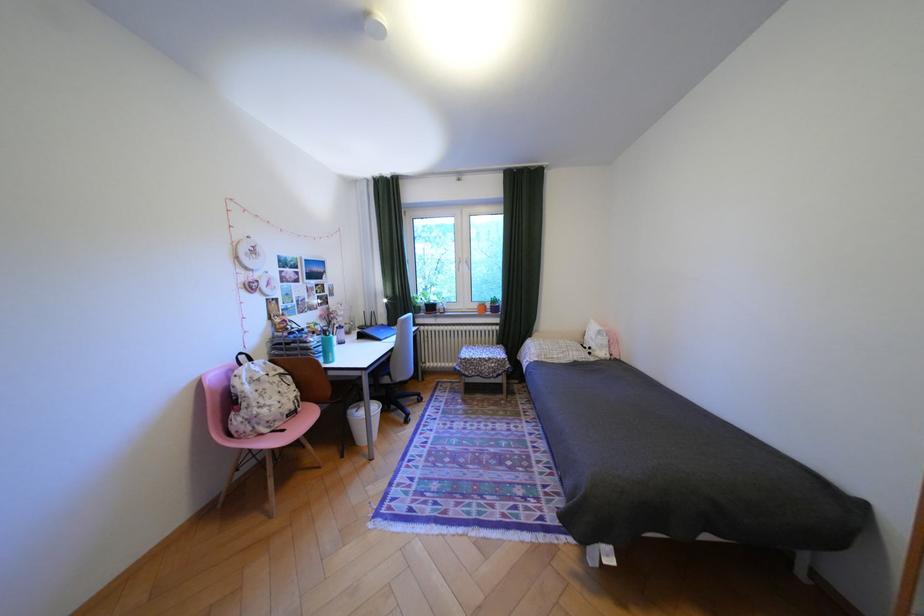
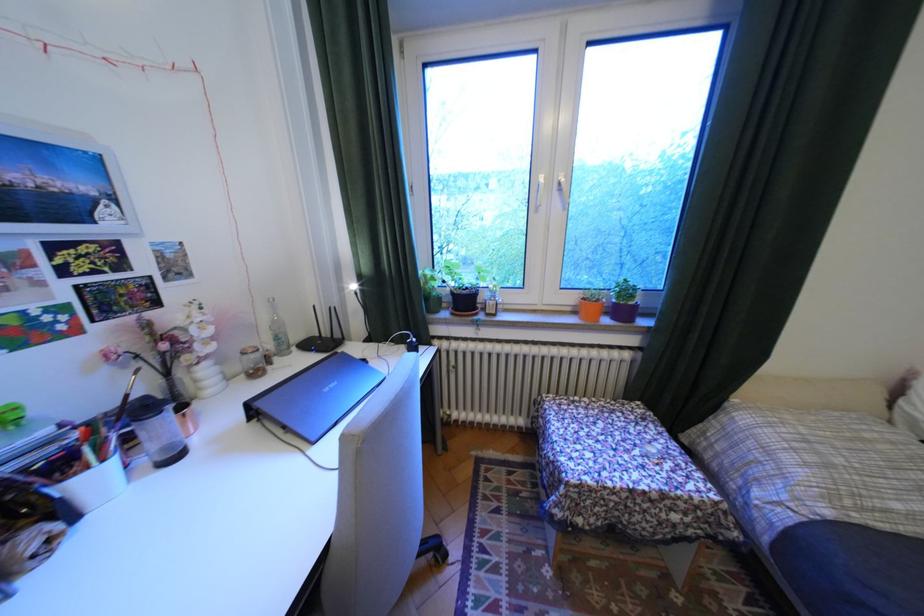
Where in the second image is the point corresponding to point (432, 307) from the first image?

(451, 299)